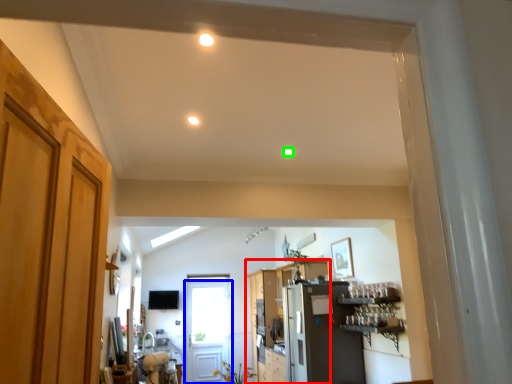
Question: Based on their relative distances, which object is nearer to cabinetry (highlighted by a red box)? Choose from door (highlighted by a blue box) and lighting (highlighted by a green box).

Choices:
 (A) door
 (B) lighting

Answer: (A)